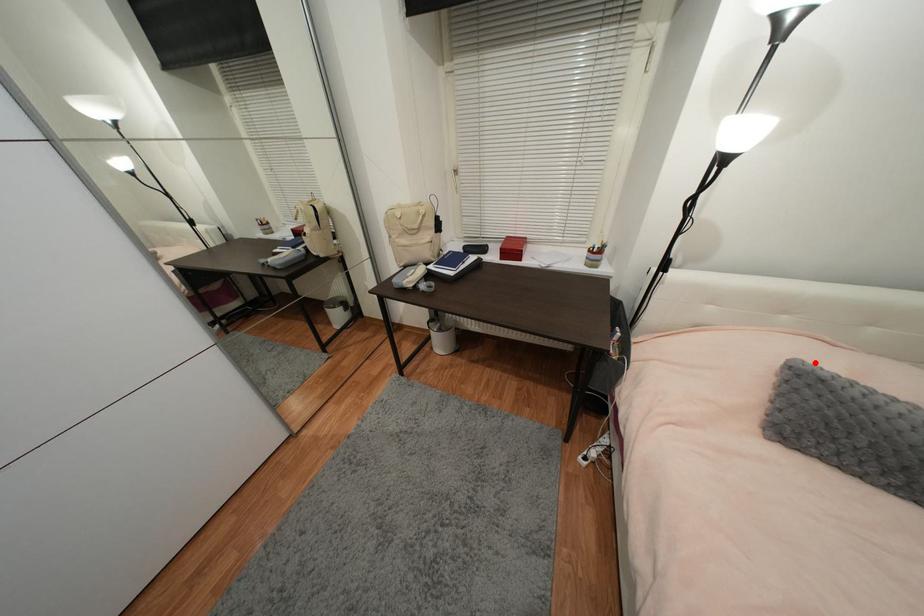
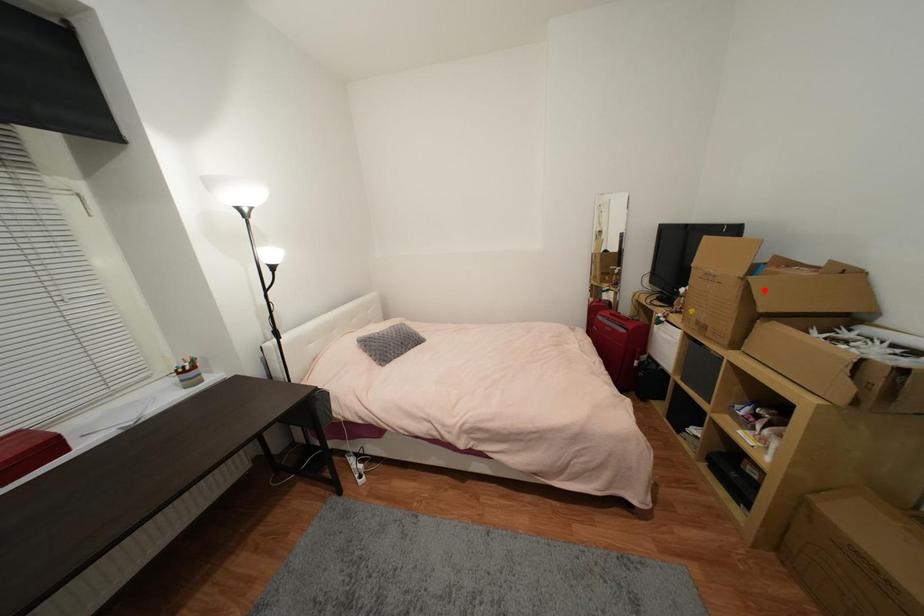
I am providing you with two images of the same scene from different viewpoints. A red point is marked on the first image and another point is marked on the second image. Are the points marked in image1 and image2 representing the same 3D position?

No